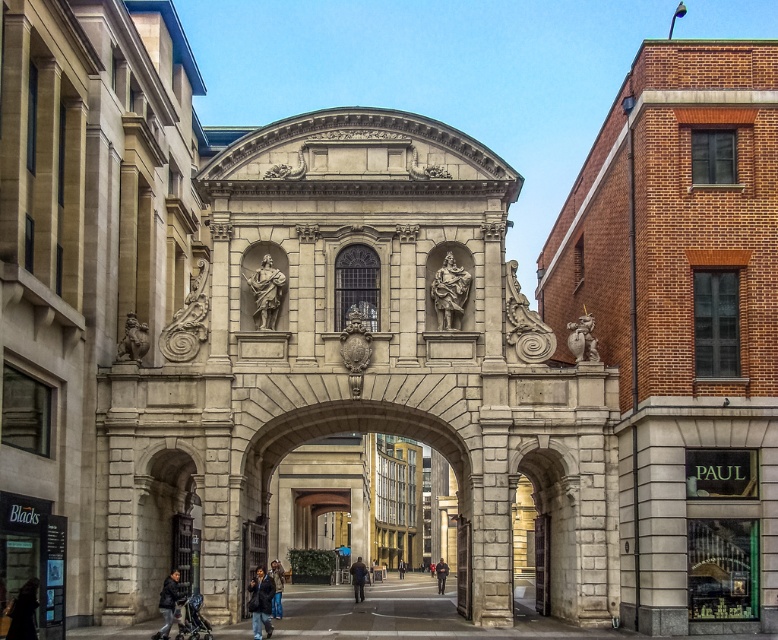
Question: Which point appears closest to the camera in this image?

Choices:
 (A) tap(542, 598)
 (B) tap(398, 563)

Answer: (A)

Question: Which of these objects is positioned closest to the dark brown leather jacket at center?

Choices:
 (A) polished stone statue at center-left
 (B) dark blue jeans at lower center
 (C) dark blue jacket at lower left
 (D) dark blue jacket at center

Answer: (B)

Question: Can you confirm if dark blue jacket at lower left is positioned to the left of dark brown leather jacket at center?

Choices:
 (A) no
 (B) yes

Answer: (B)

Question: Which of the following is the closest to the observer?

Choices:
 (A) (401, 572)
 (B) (454, 296)
 (C) (359, 579)
 (D) (18, 637)

Answer: (D)

Question: Does polished stone statue at center appear on the left side of dark blue jacket at lower left?

Choices:
 (A) no
 (B) yes

Answer: (A)

Question: Is dark brown leather jacket at center thinner than dark gray jacket at center?

Choices:
 (A) yes
 (B) no

Answer: (B)